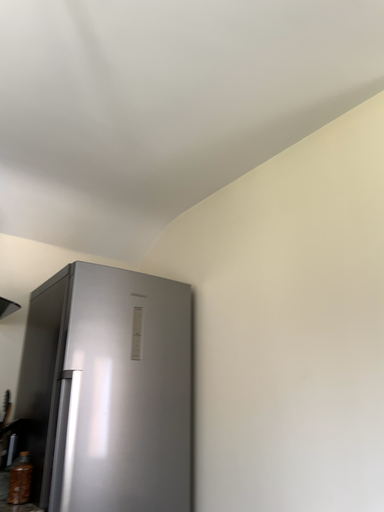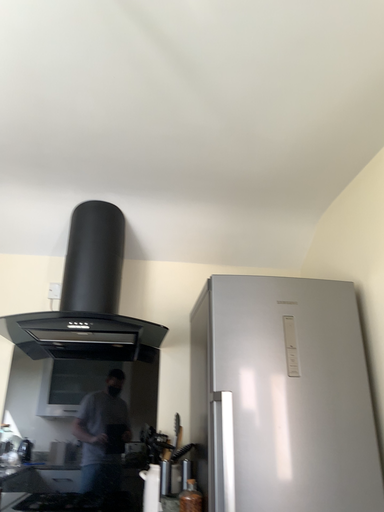
Question: How did the camera likely rotate when shooting the video?

Choices:
 (A) rotated right
 (B) rotated left

Answer: (B)